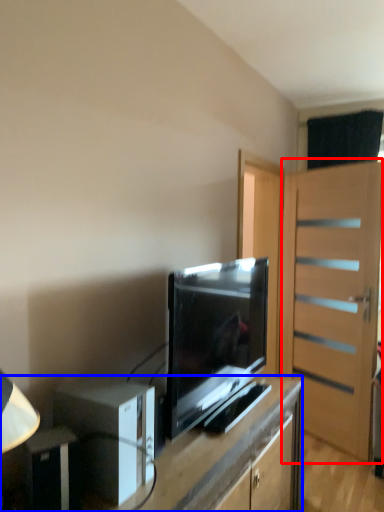
Question: Among these objects, which one is farthest to the camera, door (highlighted by a red box) or desk (highlighted by a blue box)?

Choices:
 (A) door
 (B) desk

Answer: (A)